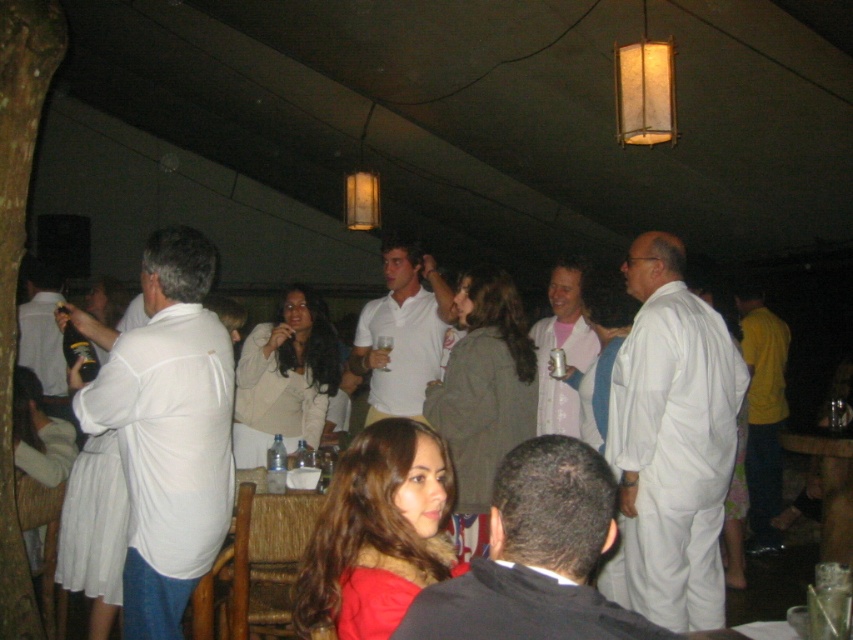
Question: Among these objects, which one is farthest from the camera?

Choices:
 (A) white matte polo shirt at center
 (B) white matte shirt at center

Answer: (A)

Question: Among these points, which one is nearest to the camera?

Choices:
 (A) (245, 452)
 (B) (543, 413)
 (C) (708, 512)
 (D) (415, 253)

Answer: (C)

Question: From the image, what is the correct spatial relationship of yellow cotton shirt at right in relation to pink fabric shirt at center?

Choices:
 (A) below
 (B) above

Answer: (A)

Question: Does matte red sweater at center appear over metallic can at center?

Choices:
 (A) yes
 (B) no

Answer: (B)

Question: Does white matte polo shirt at center have a larger size compared to pink fabric shirt at center?

Choices:
 (A) no
 (B) yes

Answer: (B)

Question: Which object is positioned farthest from the matte gray jacket at center?

Choices:
 (A) matte white shirt at left
 (B) matte beige blazer at center
 (C) pink fabric shirt at center

Answer: (A)